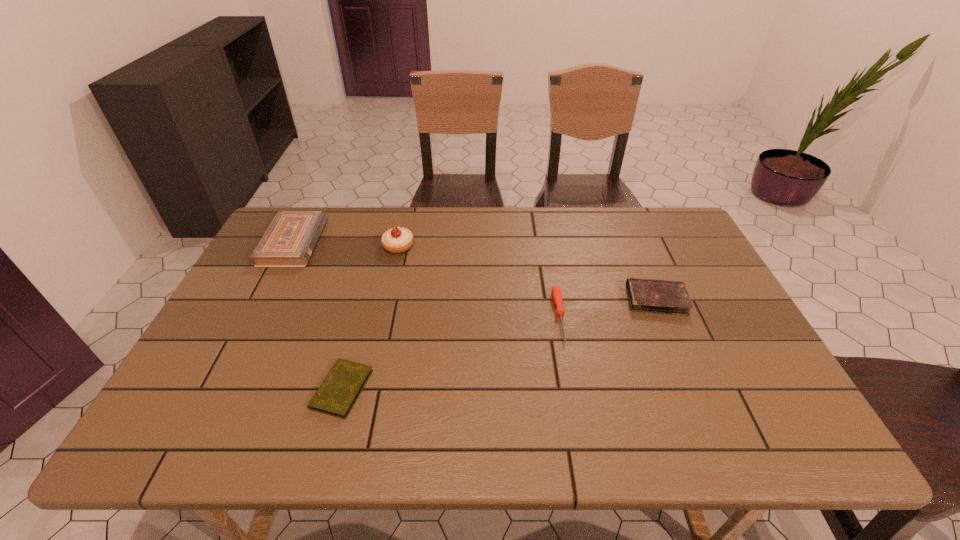
Locate an element on the screen. free location located 0.360m on the spine side of the Bible is located at coordinates (432, 242).

This screenshot has width=960, height=540. What are the coordinates of `vacant space located 0.190m on the back of the rightmost object` in the screenshot? It's located at (633, 244).

The image size is (960, 540). Identify the location of free region located at the tip of the second shortest object. pos(582,440).

This screenshot has height=540, width=960. I want to click on free spot located 0.260m on the left of the shortest object, so click(x=201, y=389).

Find the location of `pastry that is positioned at the far edge`. pastry that is positioned at the far edge is located at coordinates [x=398, y=240].

Identify the location of Bible that is at the far edge. The height and width of the screenshot is (540, 960). (290, 239).

The width and height of the screenshot is (960, 540). I want to click on object present at the near edge, so (x=336, y=396).

This screenshot has width=960, height=540. I want to click on object at the left edge, so click(x=290, y=239).

At what (x,y) coordinates should I click in order to perform the action: click on object located in the right edge section of the desktop. Please return your answer as a coordinate pair (x, y). Image resolution: width=960 pixels, height=540 pixels. Looking at the image, I should click on (645, 295).

Find the location of a particular element. This screenshot has height=540, width=960. object at the far left corner is located at coordinates (290, 239).